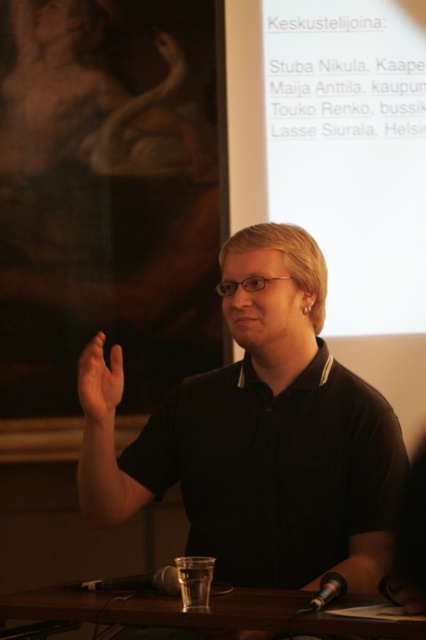
How far apart are transparent glass at lower center and metallic silver microphone at lower center?

transparent glass at lower center is 9.10 inches from metallic silver microphone at lower center.

At what (x,y) coordinates should I click in order to perform the action: click on transparent glass at lower center. Please return your answer as a coordinate pair (x, y). Looking at the image, I should click on (161, 609).

Between transparent glass at lower center and black matte microphone at lower center, which one appears on the right side from the viewer's perspective?

From the viewer's perspective, transparent glass at lower center appears more on the right side.

The image size is (426, 640). What do you see at coordinates (161, 609) in the screenshot?
I see `transparent glass at lower center` at bounding box center [161, 609].

Find the location of a particular element. This screenshot has width=426, height=640. transparent glass at lower center is located at coordinates (161, 609).

Which is more to the right, black matte shirt at center or transparent glass at lower center?

black matte shirt at center

Is point (325, 452) more distant than point (13, 595)?

Yes, point (325, 452) is farther from viewer.

Is point (386, 460) closer to viewer compared to point (357, 621)?

That is False.

Locate an element on the screen. The height and width of the screenshot is (640, 426). black matte shirt at center is located at coordinates (267, 436).